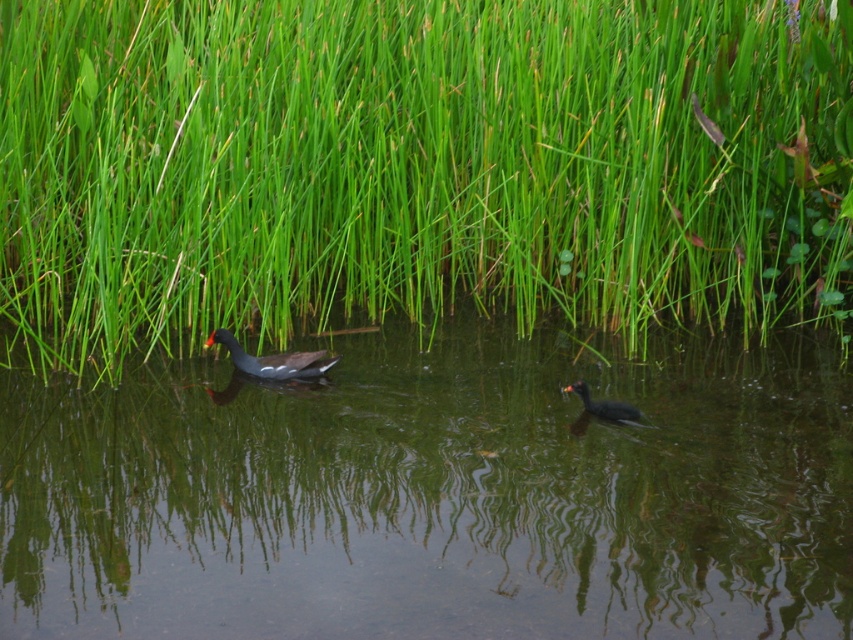
In the scene shown: Can you confirm if clear water at center is taller than dark gray matte duck at center?

Yes.

Identify the location of clear water at center. This screenshot has height=640, width=853. (434, 497).

Find the location of a particular element. clear water at center is located at coordinates (434, 497).

Who is more distant from viewer, (126, 522) or (585, 403)?

The point (585, 403) is behind.

At what (x,y) coordinates should I click in order to perform the action: click on clear water at center. Please return your answer as a coordinate pair (x, y). The image size is (853, 640). Looking at the image, I should click on (434, 497).

Does dark gray matte duck at center have a smaller size compared to dark gray matte duck at lower right?

No.

Does dark gray matte duck at center have a greater height compared to dark gray matte duck at lower right?

Yes.

Is point (242, 358) closer to viewer compared to point (631, 417)?

No.

The height and width of the screenshot is (640, 853). I want to click on dark gray matte duck at center, so click(x=273, y=360).